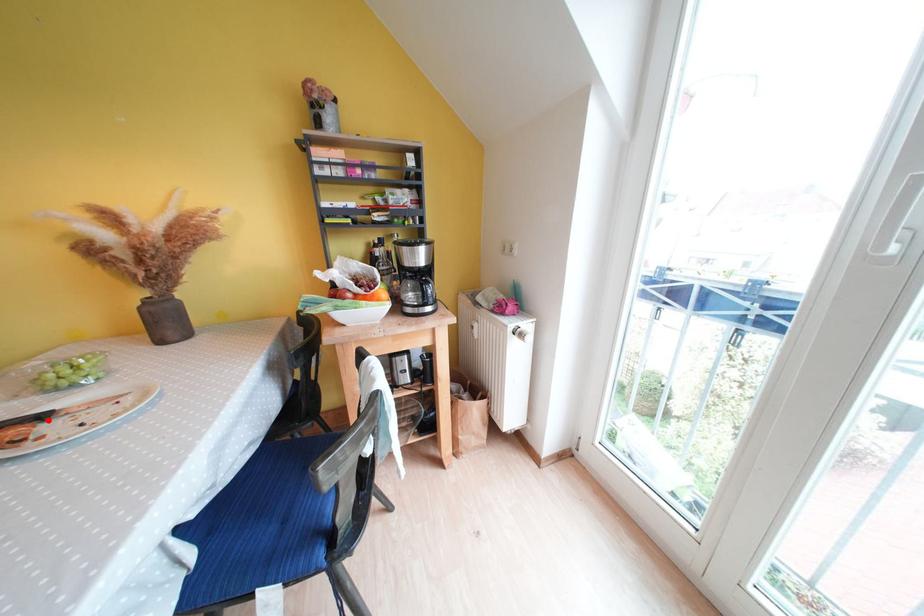
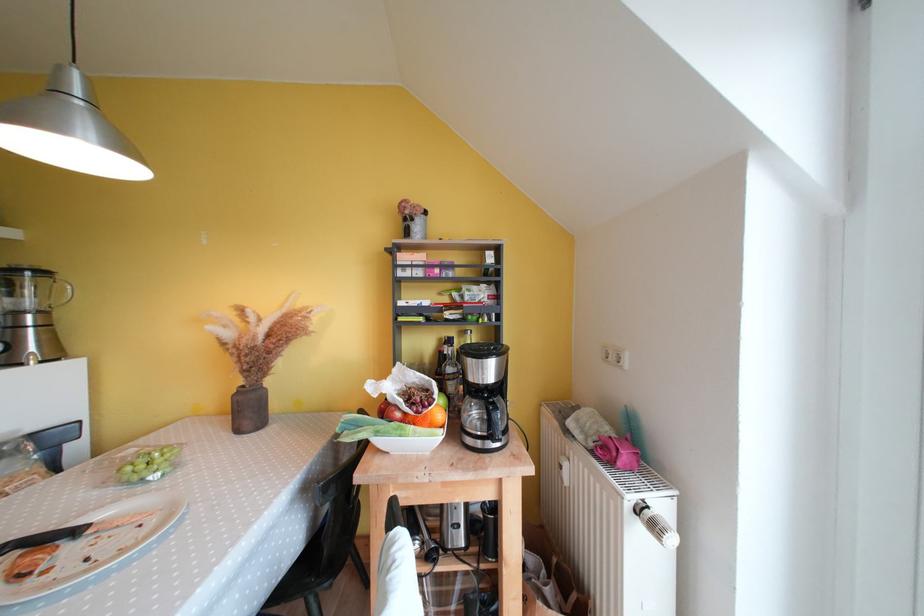
Question: I am providing you with two images of the same scene from different viewpoints. In image1, a red point is highlighted. Considering the same 3D point in image2, which of the following is correct?

Choices:
 (A) It is closer
 (B) It is farther

Answer: (B)